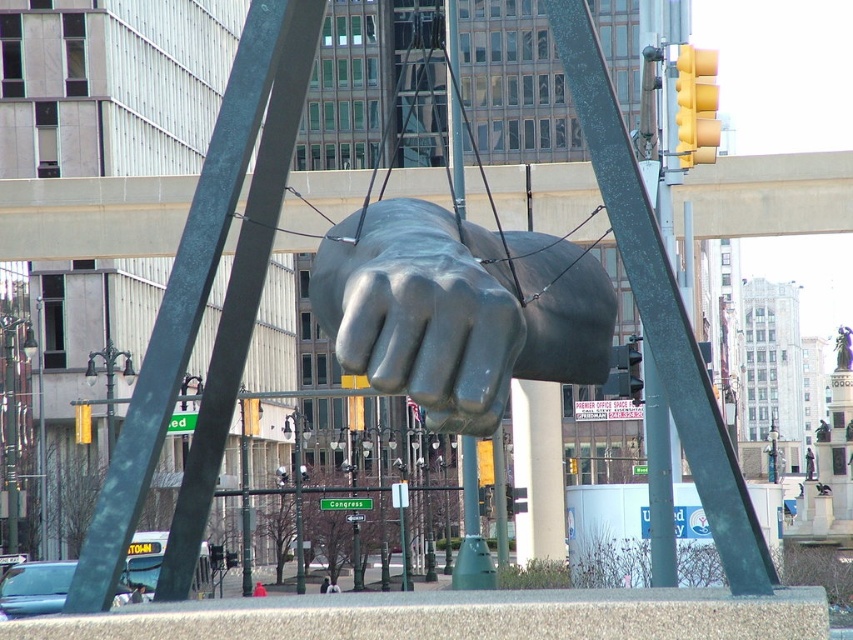
Question: Observing the image, what is the correct spatial positioning of polished bronze fist at center in reference to green patina pole at center?

Choices:
 (A) left
 (B) right

Answer: (A)

Question: Does polished bronze fist at center appear over green patina pole at center?

Choices:
 (A) yes
 (B) no

Answer: (A)

Question: Which is farther from the green patina pole at center?

Choices:
 (A) green matte pole at left
 (B) polished bronze fist at center

Answer: (A)

Question: Which point is farther from the camera taking this photo?

Choices:
 (A) click(187, 280)
 (B) click(686, 412)

Answer: (A)

Question: Does polished bronze fist at center appear over green patina pole at center?

Choices:
 (A) yes
 (B) no

Answer: (A)

Question: Which point is closer to the camera?

Choices:
 (A) (363, 276)
 (B) (688, 358)
 (C) (262, 58)

Answer: (A)